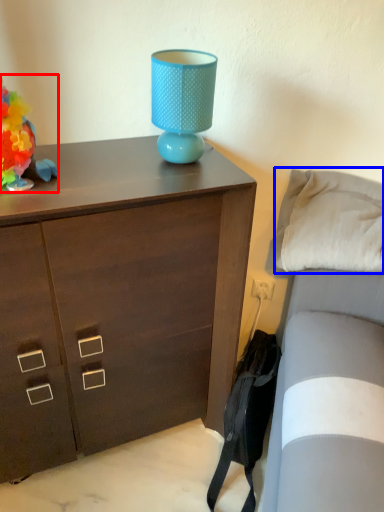
Question: Which object is closer to the camera taking this photo, toy (highlighted by a red box) or pillow (highlighted by a blue box)?

Choices:
 (A) toy
 (B) pillow

Answer: (A)